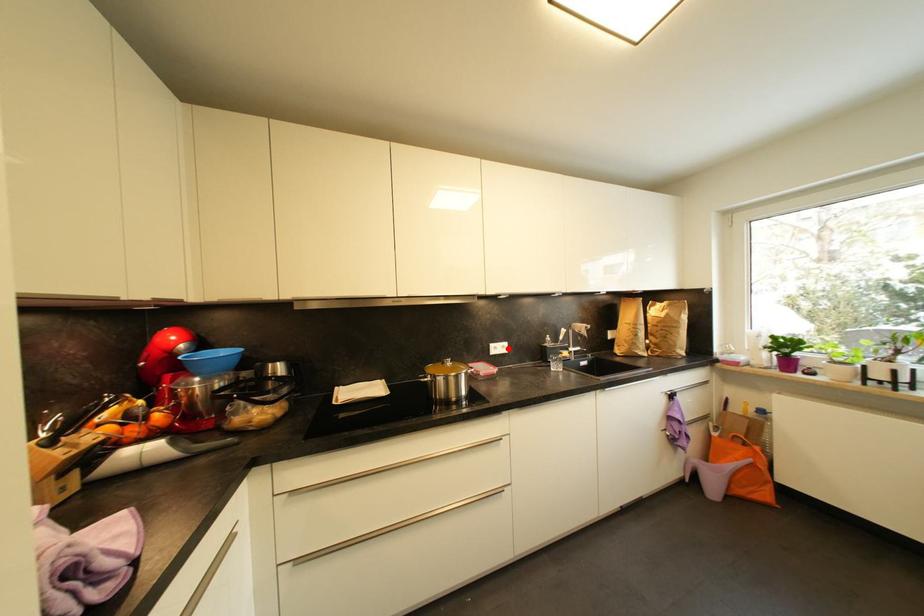
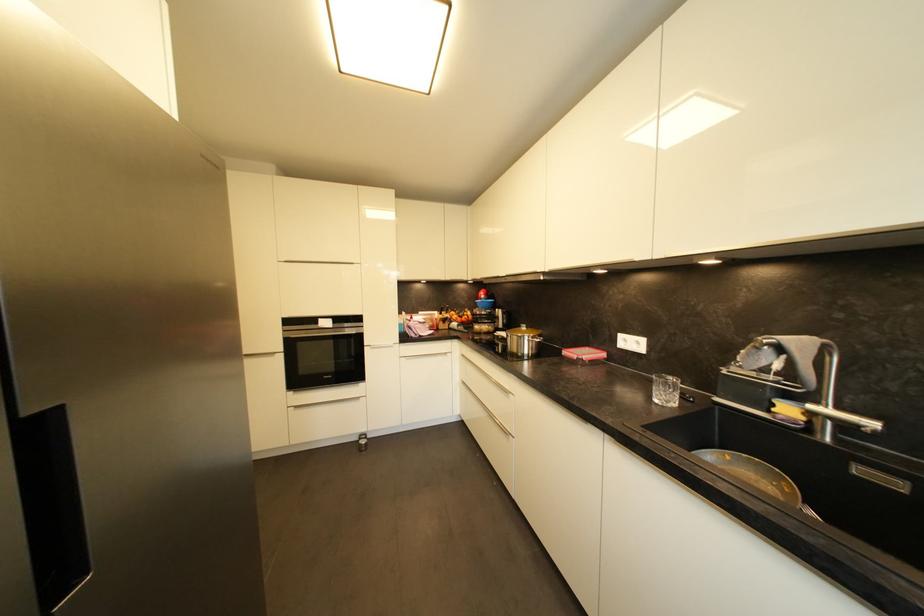
Locate, in the second image, the point that corresponds to the highlighted location in the first image.

(642, 345)